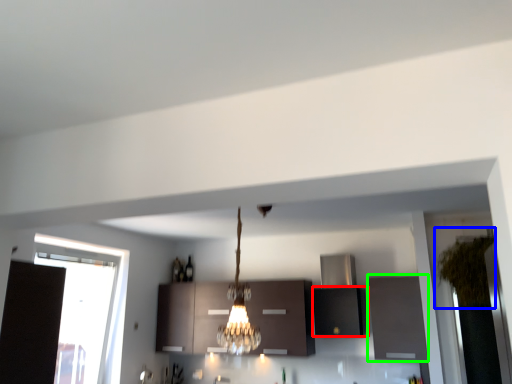
Question: Estimate the real-world distances between objects in this image. Which object is farther from cabinetry (highlighted by a red box), plant (highlighted by a blue box) or cabinetry (highlighted by a green box)?

Choices:
 (A) plant
 (B) cabinetry

Answer: (A)